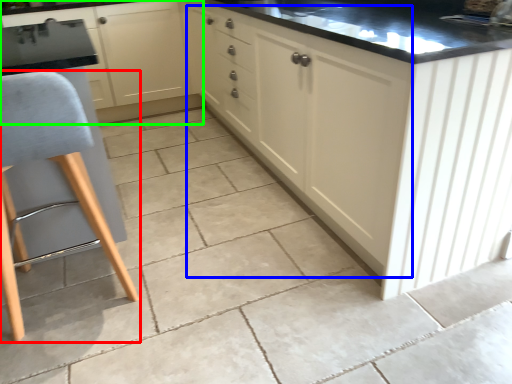
Question: Considering the real-world distances, which object is closest to furniture (highlighted by a red box)? cabinetry (highlighted by a blue box) or cabinetry (highlighted by a green box).

Choices:
 (A) cabinetry
 (B) cabinetry

Answer: (A)